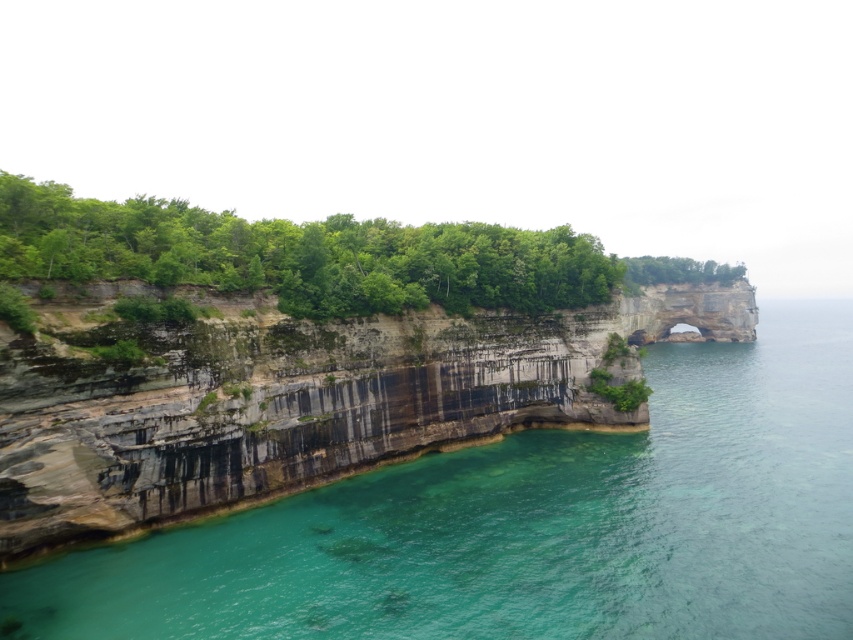
Question: Which of the following is the closest to the observer?

Choices:
 (A) (438, 284)
 (B) (656, 269)
 (C) (784, 445)

Answer: (C)

Question: Does clear water at lower left appear on the left side of green leafy tree at upper center?

Choices:
 (A) no
 (B) yes

Answer: (B)

Question: Where is clear water at lower left located in relation to green leafy tree at upper center in the image?

Choices:
 (A) below
 (B) above

Answer: (A)

Question: Does green leafy trees at upper center have a greater width compared to green leafy tree at upper center?

Choices:
 (A) no
 (B) yes

Answer: (B)

Question: Which object is positioned farthest from the green leafy tree at upper center?

Choices:
 (A) green leafy trees at upper center
 (B) clear water at lower left

Answer: (B)

Question: Estimate the real-world distances between objects in this image. Which object is farther from the green leafy trees at upper center?

Choices:
 (A) clear water at lower left
 (B) green leafy tree at upper center

Answer: (B)